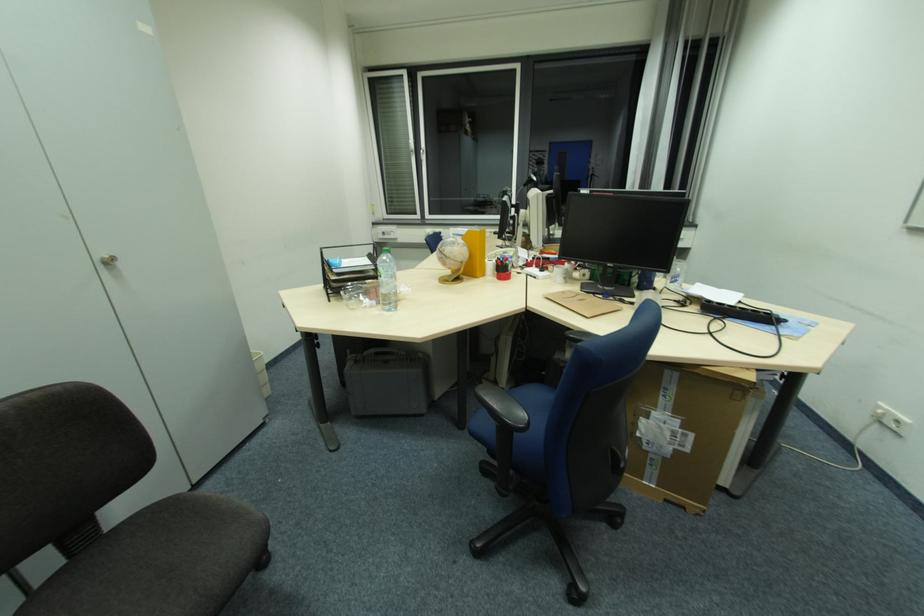
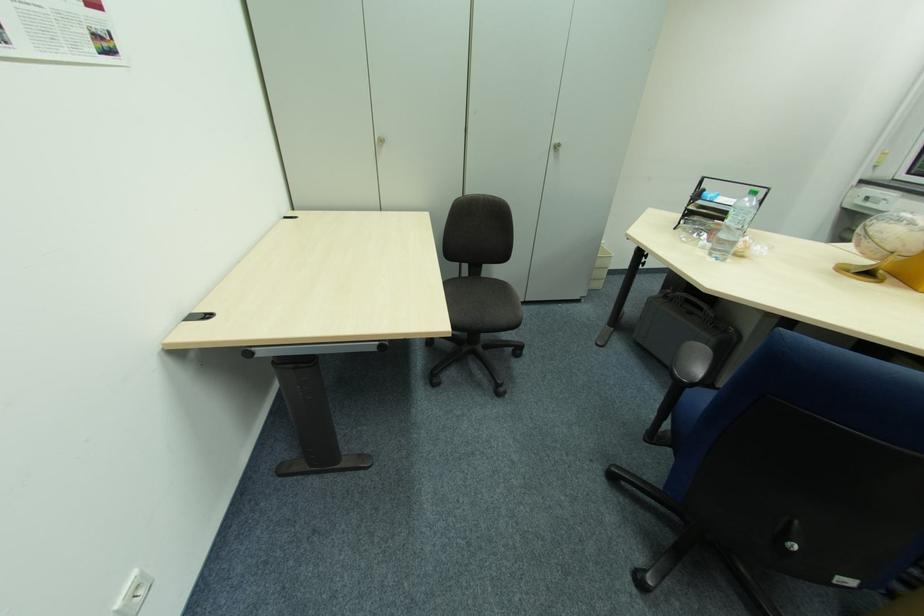
In the second image, find the point that corresponds to point 407,361 in the first image.

(711, 323)